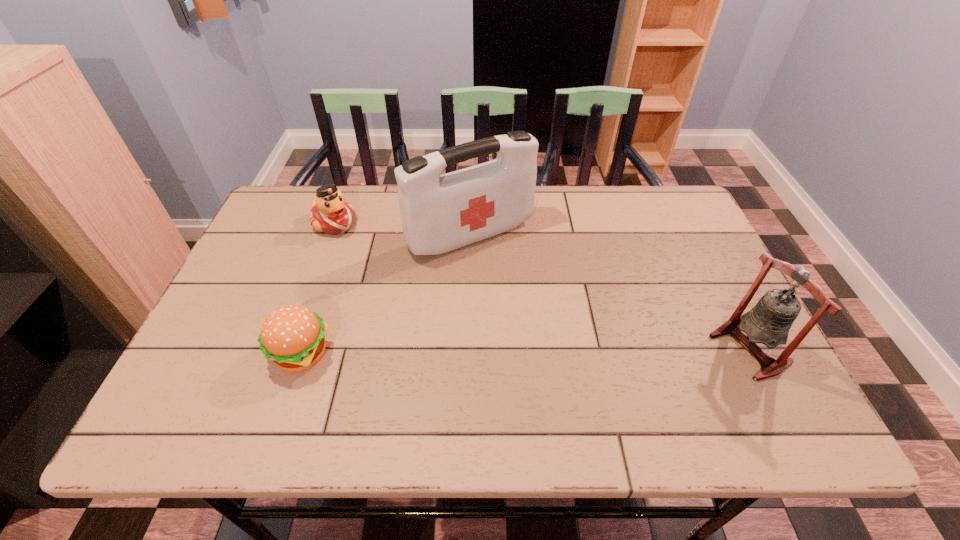
Where is `free space on the desktop that is between the hamburger and the bell and is positioned on the front side of the third object from left to right`? The image size is (960, 540). free space on the desktop that is between the hamburger and the bell and is positioned on the front side of the third object from left to right is located at coordinates (563, 350).

Where is `free space on the desktop that is between the hamburger and the bell and is positioned on the face of the duck`? free space on the desktop that is between the hamburger and the bell and is positioned on the face of the duck is located at coordinates (492, 352).